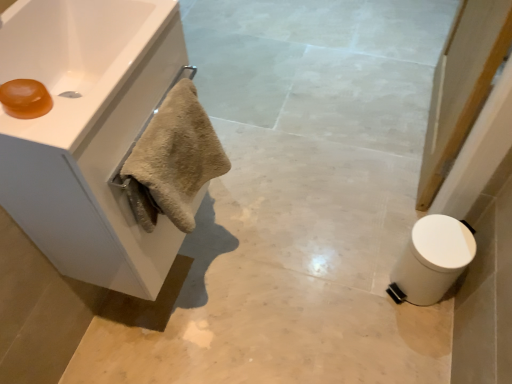
You are a GUI agent. You are given a task and a screenshot of the screen. Output one action in this format:
    pyautogui.click(x=<x>, y=<y>)
    Task: Click on the free region under beige fluffy towel at left (from a real-world perspective)
    This screenshot has height=384, width=512.
    Given the screenshot: What is the action you would take?
    pyautogui.click(x=208, y=297)